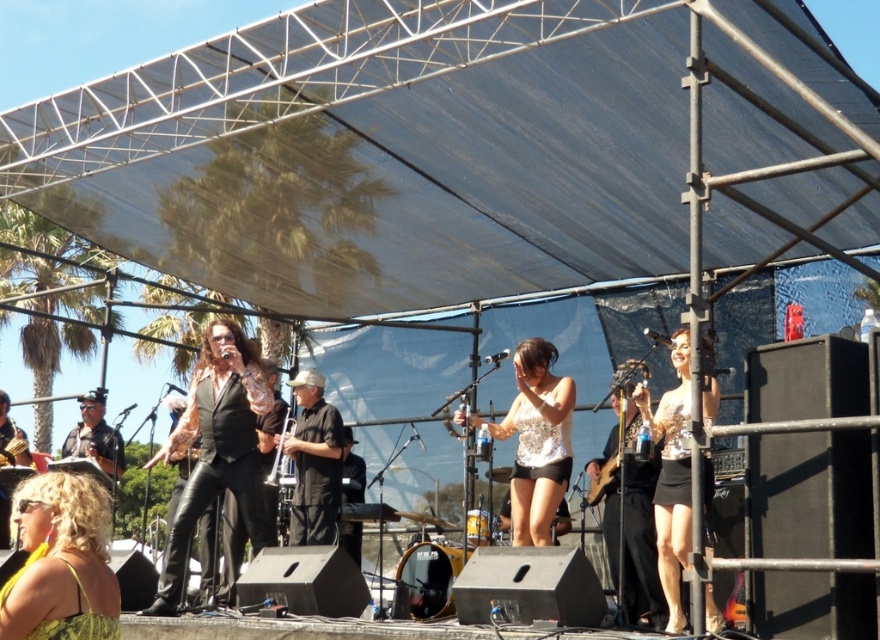
Question: Which point appears closest to the camera in this image?

Choices:
 (A) (280, 461)
 (B) (306, 406)
 (C) (552, 442)
 (D) (624, 442)

Answer: (D)

Question: Which point is farther from the camera taking this photo?

Choices:
 (A) (665, 396)
 (B) (523, 524)
 (C) (628, 429)

Answer: (C)

Question: Can you confirm if yellow-green fabric dress at lower left is positioned below silver metallic trumpet at center?

Choices:
 (A) no
 (B) yes

Answer: (B)

Question: Which object appears closest to the camera in this image?

Choices:
 (A) metallic gold guitar at center
 (B) yellow-green fabric dress at lower left
 (C) silver sequined dress at center
 (D) silver metallic trumpet at center

Answer: (B)

Question: In this image, where is silver sequined dress at center located relative to metallic gold guitar at center?

Choices:
 (A) below
 (B) above

Answer: (B)

Question: Can you confirm if yellow-green fabric dress at lower left is positioned above silver metallic trumpet at center?

Choices:
 (A) no
 (B) yes

Answer: (A)